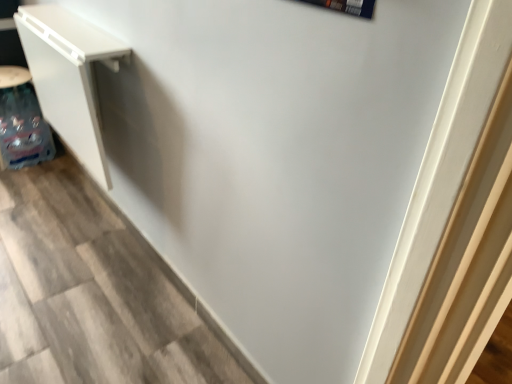
What do you see at coordinates (69, 77) in the screenshot? The width and height of the screenshot is (512, 384). I see `white matte cabinet at left` at bounding box center [69, 77].

Measure the distance between point (77, 153) and camera.

Point (77, 153) and camera are 1.71 meters apart from each other.

The width and height of the screenshot is (512, 384). In order to click on white matte cabinet at left in this screenshot , I will do `click(69, 77)`.

You are a GUI agent. You are given a task and a screenshot of the screen. Output one action in this format:
    pyautogui.click(x=<x>, y=<y>)
    Task: Click on the white matte cabinet at left
    Image resolution: width=512 pixels, height=384 pixels.
    Given the screenshot: What is the action you would take?
    pyautogui.click(x=69, y=77)